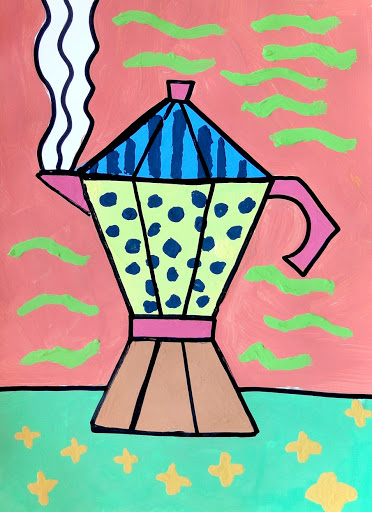
At what (x,y) coordinates should I click in order to perform the action: click on table. Please return your answer as a coordinate pair (x, y). The height and width of the screenshot is (512, 372). Looking at the image, I should click on (171, 446).